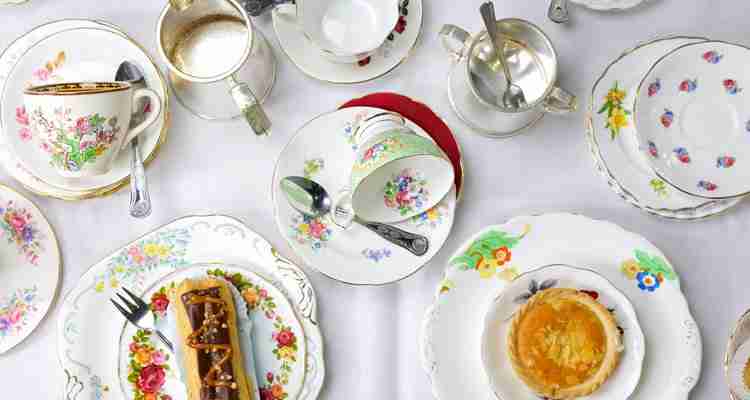
This screenshot has height=400, width=750. What are the coordinates of `cups` in the screenshot? It's located at (392, 177), (226, 66), (74, 117), (354, 39), (502, 69).